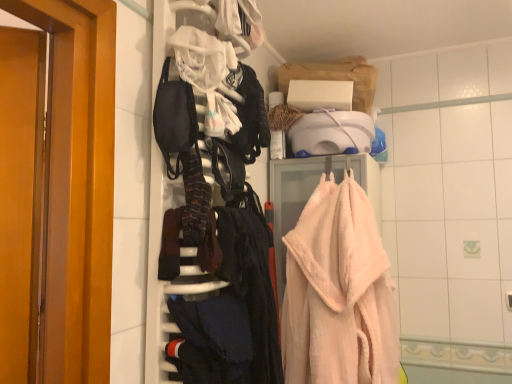
This screenshot has width=512, height=384. What do you see at coordinates (338, 292) in the screenshot? I see `fluffy pink towel at right` at bounding box center [338, 292].

In order to click on fluffy pink towel at right in this screenshot , I will do `click(338, 292)`.

Looking at this image, measure the distance between point (x=192, y=369) and camera.

38.50 inches.

This screenshot has height=384, width=512. What do you see at coordinates (213, 340) in the screenshot? I see `dark blue fabric at lower center` at bounding box center [213, 340].

Locate an element on the screen. The height and width of the screenshot is (384, 512). dark blue fabric at lower center is located at coordinates (213, 340).

Find the location of a particular element. This screenshot has width=512, height=384. fluffy pink towel at right is located at coordinates (338, 292).

Would you say fluffy pink towel at right is to the left or to the right of dark blue fabric at lower center in the picture?

Based on their positions, fluffy pink towel at right is located to the right of dark blue fabric at lower center.

Considering the positions of objects fluffy pink towel at right and dark blue fabric at lower center in the image provided, who is behind, fluffy pink towel at right or dark blue fabric at lower center?

Positioned behind is fluffy pink towel at right.

Does point (328, 231) appear closer or farther from the camera than point (190, 371)?

Point (328, 231).

From the image's perspective, between fluffy pink towel at right and dark blue fabric at lower center, who is located below?

dark blue fabric at lower center, from the image's perspective.

From a real-world perspective, is fluffy pink towel at right under dark blue fabric at lower center?

No, from a real-world perspective, fluffy pink towel at right is not beneath dark blue fabric at lower center.

Which object is wider, fluffy pink towel at right or dark blue fabric at lower center?

With larger width is fluffy pink towel at right.

Which of these two, fluffy pink towel at right or dark blue fabric at lower center, stands shorter?

dark blue fabric at lower center.

From the picture: Considering the relative sizes of fluffy pink towel at right and dark blue fabric at lower center in the image provided, is fluffy pink towel at right smaller than dark blue fabric at lower center?

Actually, fluffy pink towel at right might be larger than dark blue fabric at lower center.

Is fluffy pink towel at right located outside dark blue fabric at lower center?

Absolutely, fluffy pink towel at right is external to dark blue fabric at lower center.

Is fluffy pink towel at right touching dark blue fabric at lower center?

No, fluffy pink towel at right is not with dark blue fabric at lower center.

Is fluffy pink towel at right aimed at dark blue fabric at lower center?

Yes, fluffy pink towel at right is turned towards dark blue fabric at lower center.

How many degrees apart are the facing directions of fluffy pink towel at right and dark blue fabric at lower center?

There is a 92.5-degree angle between the facing directions of fluffy pink towel at right and dark blue fabric at lower center.

Identify the location of clothing in front of the fluffy pink towel at right. Image resolution: width=512 pixels, height=384 pixels. (213, 340).

Looking at this image, can you confirm if dark blue fabric at lower center is positioned to the right of fluffy pink towel at right?

Incorrect, dark blue fabric at lower center is not on the right side of fluffy pink towel at right.

Does dark blue fabric at lower center lie behind fluffy pink towel at right?

No.

Between point (214, 368) and point (307, 346), which one is positioned behind?

Positioned behind is point (307, 346).

From the image's perspective, which object appears higher, dark blue fabric at lower center or fluffy pink towel at right?

fluffy pink towel at right, from the image's perspective.

From a real-world perspective, relative to fluffy pink towel at right, is dark blue fabric at lower center vertically above or below?

dark blue fabric at lower center is below fluffy pink towel at right.

In the scene shown: Which of these two, dark blue fabric at lower center or fluffy pink towel at right, is thinner?

dark blue fabric at lower center is thinner.

Considering the sizes of dark blue fabric at lower center and fluffy pink towel at right in the image, is dark blue fabric at lower center taller or shorter than fluffy pink towel at right?

Clearly, dark blue fabric at lower center is shorter compared to fluffy pink towel at right.

Consider the image. Is dark blue fabric at lower center bigger or smaller than fluffy pink towel at right?

Clearly, dark blue fabric at lower center is smaller in size than fluffy pink towel at right.

Could fluffy pink towel at right be considered to be inside dark blue fabric at lower center?

No.

Is dark blue fabric at lower center far away from fluffy pink towel at right?

No, dark blue fabric at lower center is not far from fluffy pink towel at right.

Looking at this image, is dark blue fabric at lower center facing away from fluffy pink towel at right?

No, dark blue fabric at lower center's orientation is not away from fluffy pink towel at right.

Based on the photo, how many degrees apart are the facing directions of dark blue fabric at lower center and fluffy pink towel at right?

The angular difference between dark blue fabric at lower center and fluffy pink towel at right is 92.5 degrees.

In the image, there is a fluffy pink towel at right. Identify the location of clothing below it (from a real-world perspective). This screenshot has width=512, height=384. (213, 340).

Image resolution: width=512 pixels, height=384 pixels. In order to click on clothing on the left of fluffy pink towel at right in this screenshot , I will do `click(213, 340)`.

Locate an element on the screen. This screenshot has height=384, width=512. towel above the dark blue fabric at lower center (from the image's perspective) is located at coordinates (338, 292).